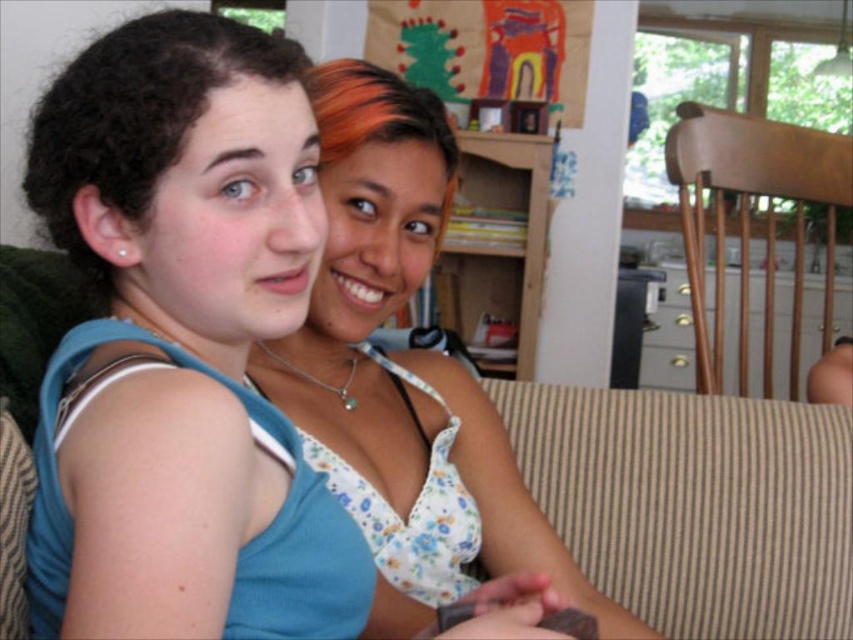
Where is the floral fabric top at center located in the image?

The floral fabric top at center is located at point (404, 372) in the image.

You are a fashion designer observing two tops displayed in the center of an image. The blue fabric tank top at center and the floral fabric top at center. Which top is shorter in height?

The blue fabric tank top at center is not as tall as the floral fabric top at center, so the blue fabric tank top at center is shorter in height.

You are standing in front of the image and want to determine which of the two points, point (x=115, y=166) or point (x=670, y=456), is nearer to you. Based on the scene, which point is closer?

Point (x=115, y=166) is closer to the viewer than point (x=670, y=456).